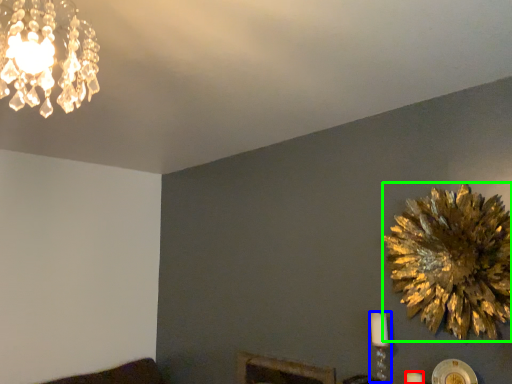
Question: Based on their relative distances, which object is nearer to candle (highlighted by a red box)? Choose from candle holder (highlighted by a blue box) and flower (highlighted by a green box).

Choices:
 (A) candle holder
 (B) flower

Answer: (A)